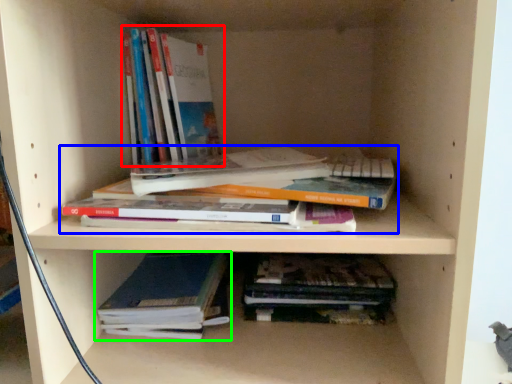
Question: Estimate the real-world distances between objects in this image. Which object is closer to book (highlighted by a red box), book (highlighted by a blue box) or book (highlighted by a green box)?

Choices:
 (A) book
 (B) book

Answer: (A)